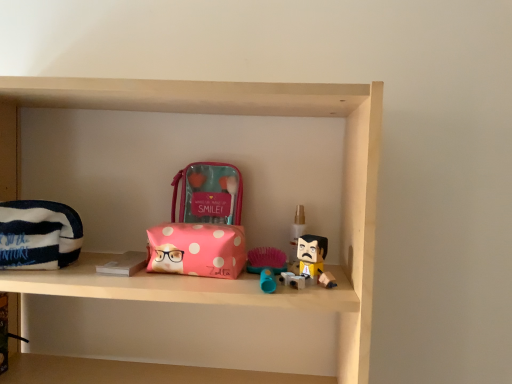
Question: Considering the positions of striped fabric pouch at left, arranged as the 1th pouch when viewed from the left, and translucent plastic spray bottle at center in the image, is striped fabric pouch at left, arranged as the 1th pouch when viewed from the left, taller or shorter than translucent plastic spray bottle at center?

Choices:
 (A) tall
 (B) short

Answer: (A)

Question: Looking at their shapes, would you say striped fabric pouch at left, arranged as the 1th pouch when ordered from the bottom, is wider or thinner than translucent plastic spray bottle at center?

Choices:
 (A) wide
 (B) thin

Answer: (A)

Question: Estimate the real-world distances between objects in this image. Which object is farther from the pink polka dot fabric pouch at center?

Choices:
 (A) translucent plastic spray bottle at center
 (B) pink polka dot pouch at center, which is the 2th pouch in left-to-right order
 (C) striped fabric pouch at left, arranged as the 1th pouch when ordered from the bottom

Answer: (C)

Question: Which object is the closest to the striped fabric pouch at left, which ranks as the 2th pouch in top-to-bottom order?

Choices:
 (A) pink polka dot fabric pouch at center
 (B) pink polka dot pouch at center, marked as the first pouch in a right-to-left arrangement
 (C) translucent plastic spray bottle at center

Answer: (A)